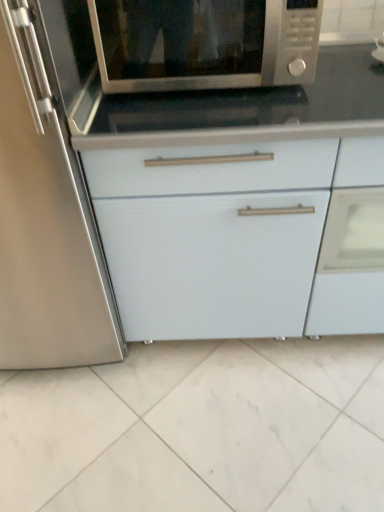
Find the location of a particular element. white matte cabinet at center is located at coordinates (182, 196).

The height and width of the screenshot is (512, 384). What do you see at coordinates (182, 196) in the screenshot? I see `white matte cabinet at center` at bounding box center [182, 196].

Image resolution: width=384 pixels, height=512 pixels. Describe the element at coordinates (204, 42) in the screenshot. I see `satin silver microwave at upper center` at that location.

What is the approximate height of satin silver microwave at upper center?

satin silver microwave at upper center is 8.76 inches tall.

Image resolution: width=384 pixels, height=512 pixels. I want to click on satin silver microwave at upper center, so click(x=204, y=42).

The image size is (384, 512). I want to click on white matte cabinet at center, so click(x=182, y=196).

Which is more to the right, white matte cabinet at center or satin silver microwave at upper center?

From the viewer's perspective, white matte cabinet at center appears more on the right side.

Considering the positions of objects white matte cabinet at center and satin silver microwave at upper center in the image provided, who is in front, white matte cabinet at center or satin silver microwave at upper center?

satin silver microwave at upper center is in front.

Is point (180, 213) closer to camera compared to point (116, 20)?

That is False.

From the image's perspective, is white matte cabinet at center under satin silver microwave at upper center?

Correct, white matte cabinet at center appears lower than satin silver microwave at upper center in the image.

From a real-world perspective, is white matte cabinet at center physically located above or below satin silver microwave at upper center?

In terms of real-world spatial position, white matte cabinet at center is below satin silver microwave at upper center.

Considering the sizes of objects white matte cabinet at center and satin silver microwave at upper center in the image provided, who is thinner, white matte cabinet at center or satin silver microwave at upper center?

satin silver microwave at upper center.

Considering the relative sizes of white matte cabinet at center and satin silver microwave at upper center in the image provided, is white matte cabinet at center shorter than satin silver microwave at upper center?

No.

Considering the relative sizes of white matte cabinet at center and satin silver microwave at upper center in the image provided, is white matte cabinet at center bigger than satin silver microwave at upper center?

Correct, white matte cabinet at center is larger in size than satin silver microwave at upper center.

Is white matte cabinet at center spatially inside satin silver microwave at upper center, or outside of it?

white matte cabinet at center cannot be found inside satin silver microwave at upper center.

Are white matte cabinet at center and satin silver microwave at upper center far apart?

Actually, white matte cabinet at center and satin silver microwave at upper center are a little close together.

Is white matte cabinet at center looking in the opposite direction of satin silver microwave at upper center?

No, white matte cabinet at center's orientation is not away from satin silver microwave at upper center.

Measure the distance from white matte cabinet at center to satin silver microwave at upper center.

10.43 inches.

Locate an element on the screen. The image size is (384, 512). cabinetry on the right of satin silver microwave at upper center is located at coordinates (182, 196).

Between satin silver microwave at upper center and white matte cabinet at center, which one appears on the right side from the viewer's perspective?

Positioned to the right is white matte cabinet at center.

Does satin silver microwave at upper center lie behind white matte cabinet at center?

No.

Does point (215, 62) lie behind point (269, 222)?

No, it is in front of (269, 222).

From the image's perspective, does satin silver microwave at upper center appear higher than white matte cabinet at center?

Yes, from the image's perspective, satin silver microwave at upper center is over white matte cabinet at center.

From a real-world perspective, which object rests below the other?

white matte cabinet at center, from a real-world perspective.

Which of these two, satin silver microwave at upper center or white matte cabinet at center, is thinner?

With smaller width is satin silver microwave at upper center.

Looking at this image, can you confirm if satin silver microwave at upper center is shorter than white matte cabinet at center?

Correct, satin silver microwave at upper center is not as tall as white matte cabinet at center.

Who is smaller, satin silver microwave at upper center or white matte cabinet at center?

satin silver microwave at upper center is smaller.

Does satin silver microwave at upper center contain white matte cabinet at center?

That's incorrect, white matte cabinet at center is not inside satin silver microwave at upper center.

Is satin silver microwave at upper center touching white matte cabinet at center?

No, satin silver microwave at upper center is not beside white matte cabinet at center.

Is satin silver microwave at upper center facing towards white matte cabinet at center?

No, satin silver microwave at upper center is not oriented towards white matte cabinet at center.

How far apart are satin silver microwave at upper center and white matte cabinet at center?

satin silver microwave at upper center is 10.43 inches from white matte cabinet at center.

This screenshot has height=512, width=384. In order to click on microwave oven to the left of white matte cabinet at center in this screenshot , I will do (x=204, y=42).

Image resolution: width=384 pixels, height=512 pixels. I want to click on microwave oven on the left of white matte cabinet at center, so click(x=204, y=42).

This screenshot has height=512, width=384. Find the location of `cabinetry directly beneath the satin silver microwave at upper center (from a real-world perspective)`. cabinetry directly beneath the satin silver microwave at upper center (from a real-world perspective) is located at coordinates (182, 196).